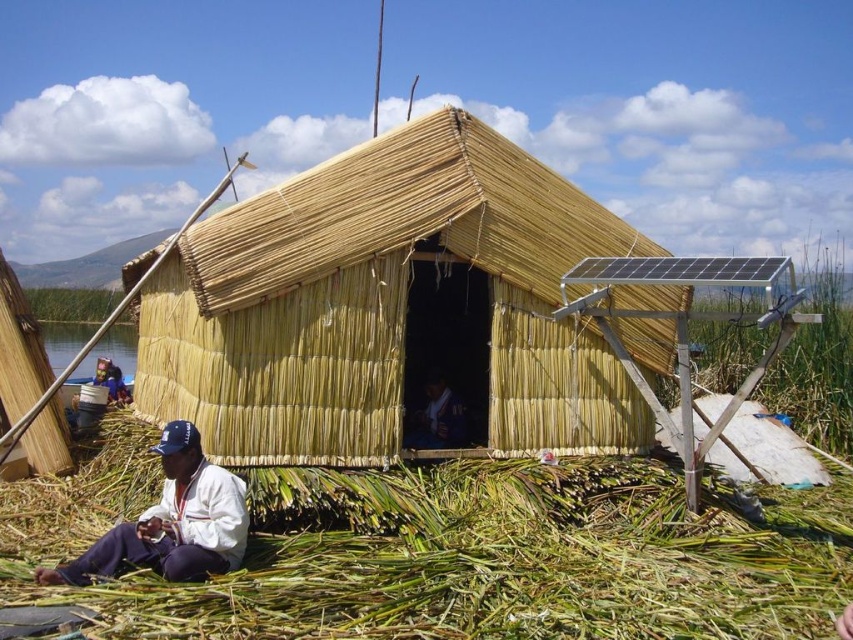
What is the exact location of the green grassy hay at lower center in the image?

The green grassy hay at lower center is located at point (x=473, y=560).

You are a visitor standing in front of the reed hut. You notice the green grassy hay at lower center and the white fabric at lower left. Which object is closer to you?

The green grassy hay at lower center is closer to you because it is in front of the white fabric at lower left.